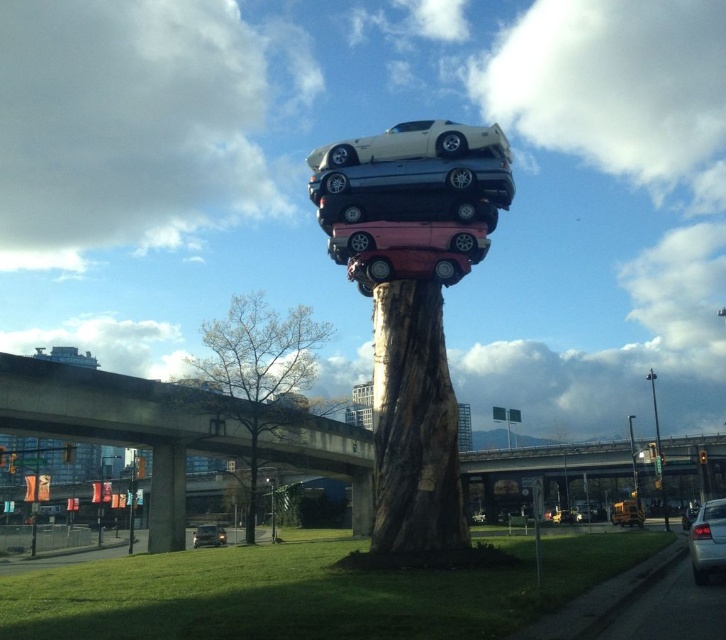
You are an artist planning to photograph the brown wood tree trunk at center and the metallic silver car at center from a distance. Which object will appear larger in the photo?

The brown wood tree trunk at center will appear larger in the photo because it is bigger than the metallic silver car at center.

Looking at this image, you are a photographer positioned at the lower left corner of the sculpture. You want to capture a photo of the metallic silver car at center and the metallic silver sedan at lower left in the same frame. Which direction should you move to ensure both cars are visible in your camera view?

You should move to the right to include both the metallic silver car at center and the metallic silver sedan at lower left in your camera view since the metallic silver car at center is to the right of the metallic silver sedan at lower left.

You are an artist planning to paint the urban sculpture. You need to know the spatial relationship between the brown wood tree trunk at center and the metallic silver car at center. Can you tell me which one is positioned above the other?

The brown wood tree trunk at center is located below metallic silver car at center, so the metallic silver car at center is positioned above the brown wood tree trunk at center.